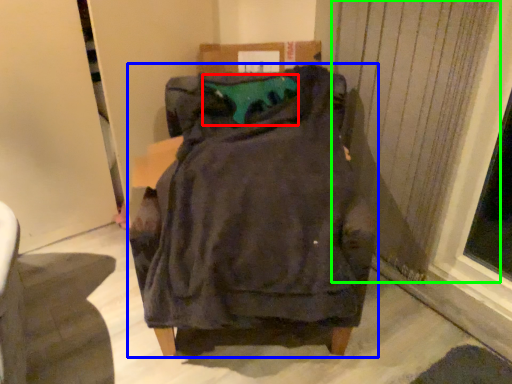
Question: Based on their relative distances, which object is farther from teal (highlighted by a red box)? Choose from furniture (highlighted by a blue box) and curtain (highlighted by a green box).

Choices:
 (A) furniture
 (B) curtain

Answer: (B)